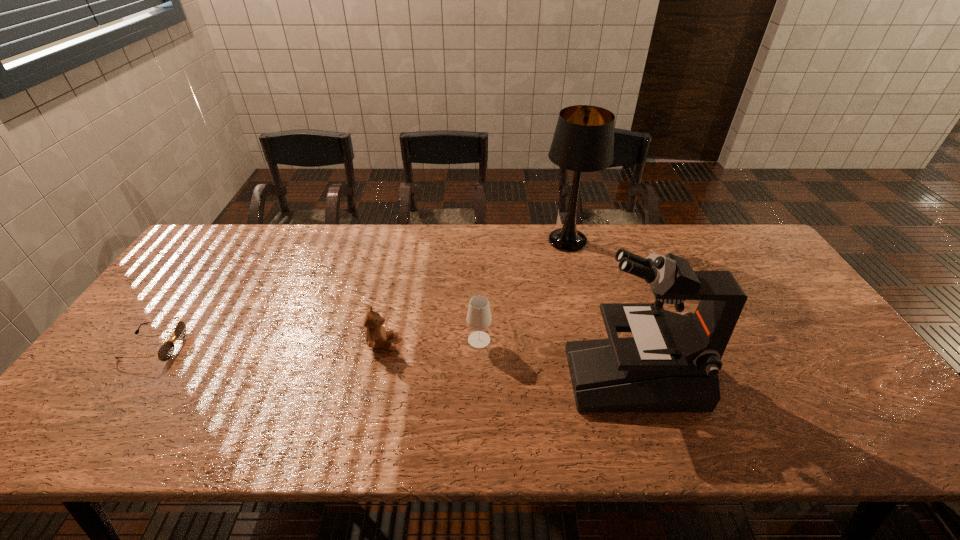
Locate an element on the screen. Image resolution: width=960 pixels, height=540 pixels. vacant point located between the second shortest object and the table lamp is located at coordinates (475, 292).

Locate an element on the screen. The height and width of the screenshot is (540, 960). object that stands as the fourth closest to the third object from left to right is located at coordinates (165, 352).

Find the location of `the second closest object relative to the microscope`. the second closest object relative to the microscope is located at coordinates (583, 141).